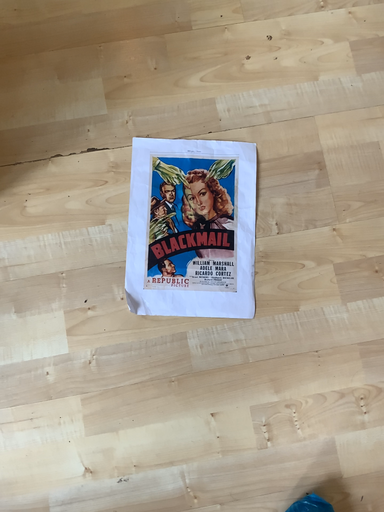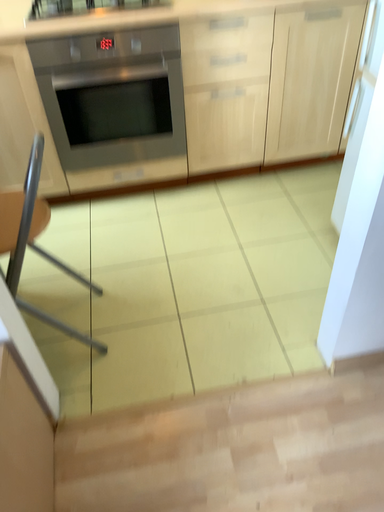
Question: How did the camera likely rotate when shooting the video?

Choices:
 (A) rotated upward
 (B) rotated downward

Answer: (A)